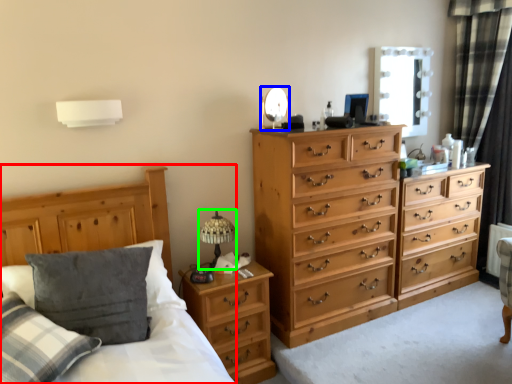
Question: Estimate the real-world distances between objects in this image. Which object is farther from bed frame (highlighted by a red box), mirror (highlighted by a blue box) or table lamp (highlighted by a green box)?

Choices:
 (A) mirror
 (B) table lamp

Answer: (A)